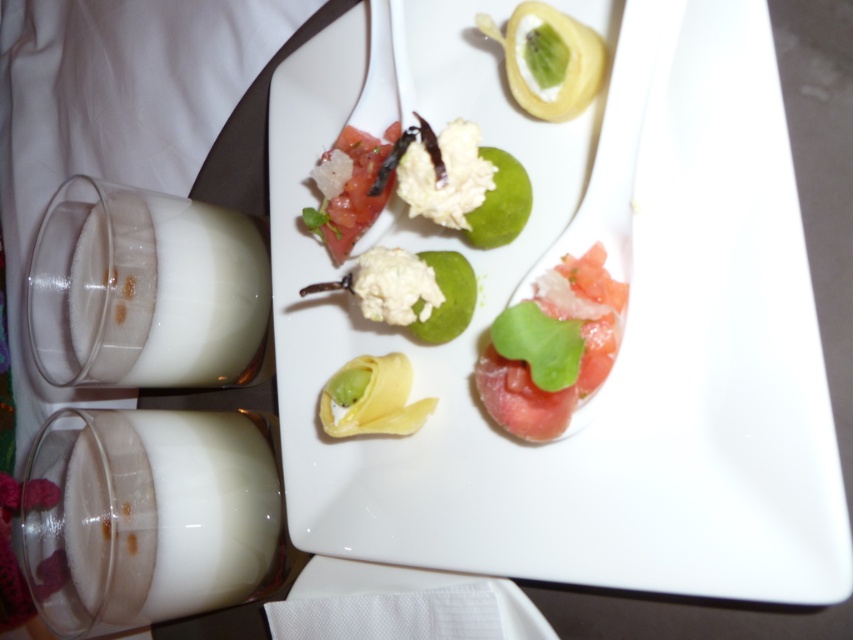
You are a server in a restaurant and need to check if the white creamy milk at left can fit into a container that is the same size as the yellow matte pastry at center. Based on their sizes, will it fit?

The white creamy milk at left is wider than the yellow matte pastry at center, so it will not fit into a container the same size as the yellow matte pastry at center.

You are a waiter holding a tray of dishes. You need to place a new appetizer on the table at the point marked by coordinates point (779, 241). The table is 1.2 meters away from you. Is the point within your reach?

The point (779, 241) is 37.33 centimeters away from the viewer. Since the table is 1.2 meters away, which is 120 centimeters, the point is closer than the edge of the table, so yes, the point is within reach.

You are a food critic sitting at the table. You want to reach for the white creamy milk at lower left and the fresh tomato at center. Which one is closer to your right hand?

The fresh tomato at center is closer to your right hand because it is located above the white creamy milk at lower left, which is positioned below it.